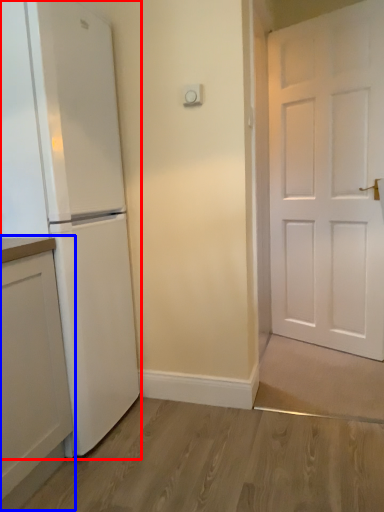
Question: Which object appears closest to the camera in this image, refrigerator (highlighted by a red box) or cabinetry (highlighted by a blue box)?

Choices:
 (A) refrigerator
 (B) cabinetry

Answer: (B)